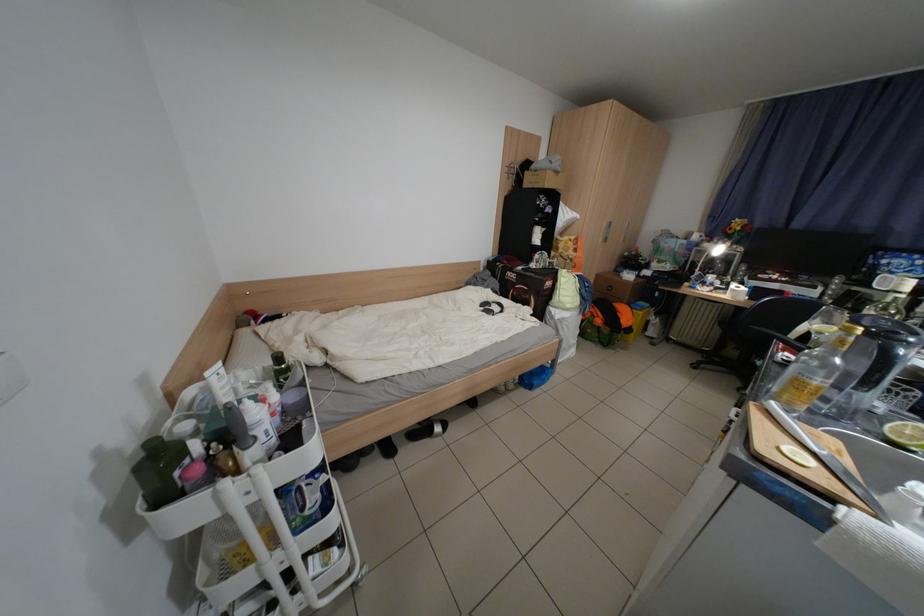
Find the location of a particular element. chair sitting surface is located at coordinates (743, 317).